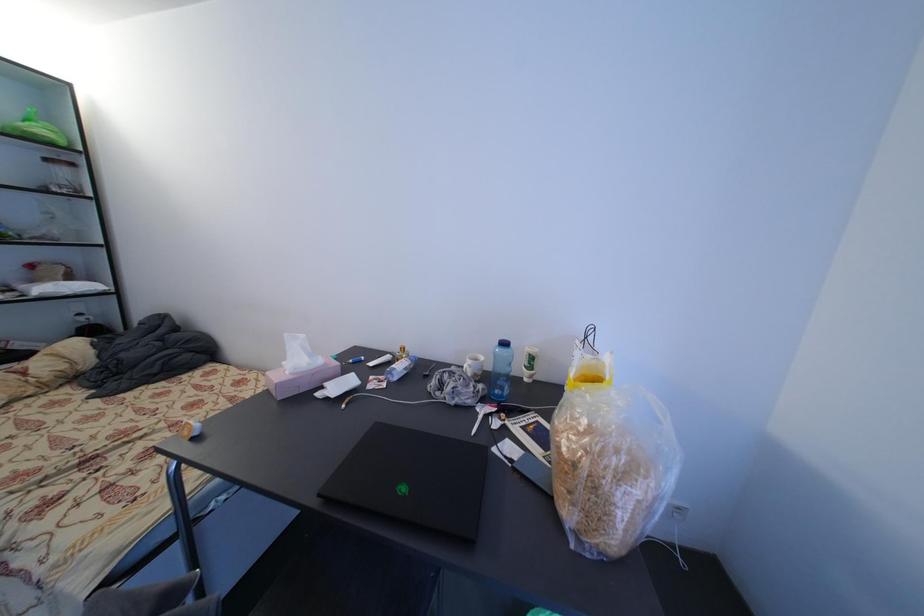
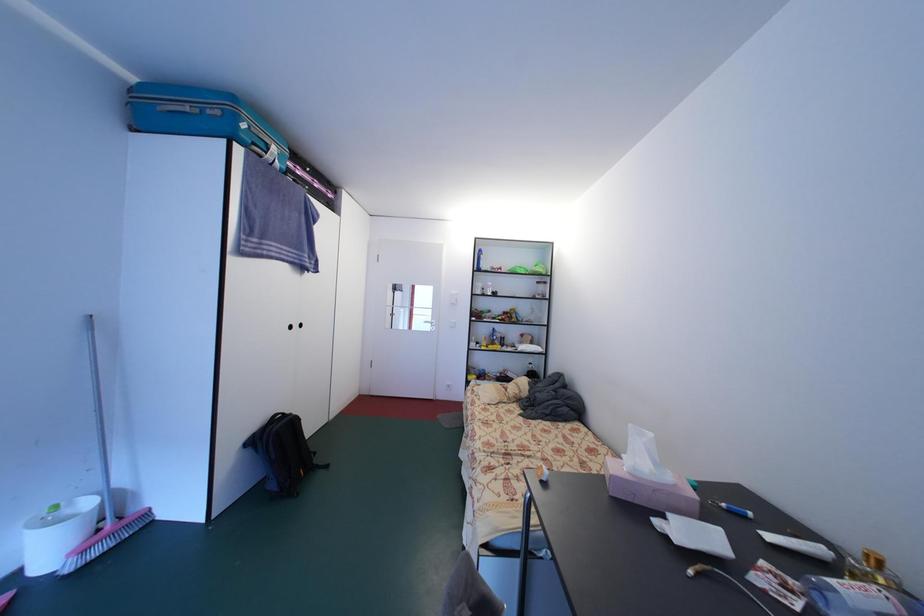
Question: The images are taken continuously from a first-person perspective. In which direction is your viewpoint rotating?

Choices:
 (A) Left
 (B) Right
 (C) Up
 (D) Down

Answer: (A)